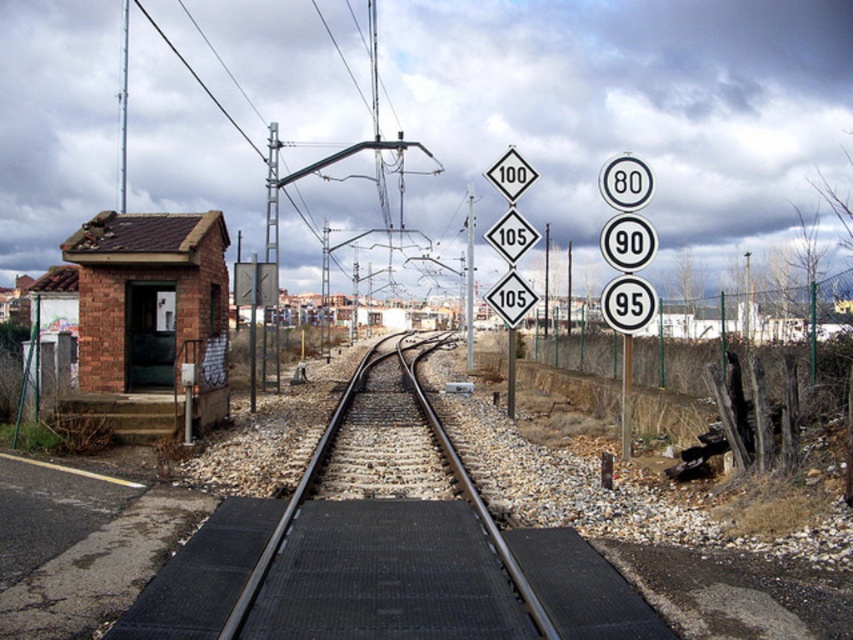
You are a maintenance worker who needs to place a new sign on the metallic pole at right. The sign you have is 1.2 meters wide. Can you fit it on the pole without overlapping the black metal train track at center?

The black metal train track at center has a larger size compared to metallic pole at right. Since the pole is smaller, the 1.2 meter wide sign may not fit properly and could overlap the track.

You are a maintenance worker standing at the black metal train track at center. You need to reach the metallic pole at right to inspect it. Given that your tool kit weighs 15 kg and you can carry it for up to 12 meters before needing a rest, will you be able to walk to the pole without needing to rest?

The black metal train track at center is 11.55 meters from the metallic pole at right. Since 11.55 meters is within your 12 meter carrying capacity, you can reach the metallic pole at right without needing to rest.